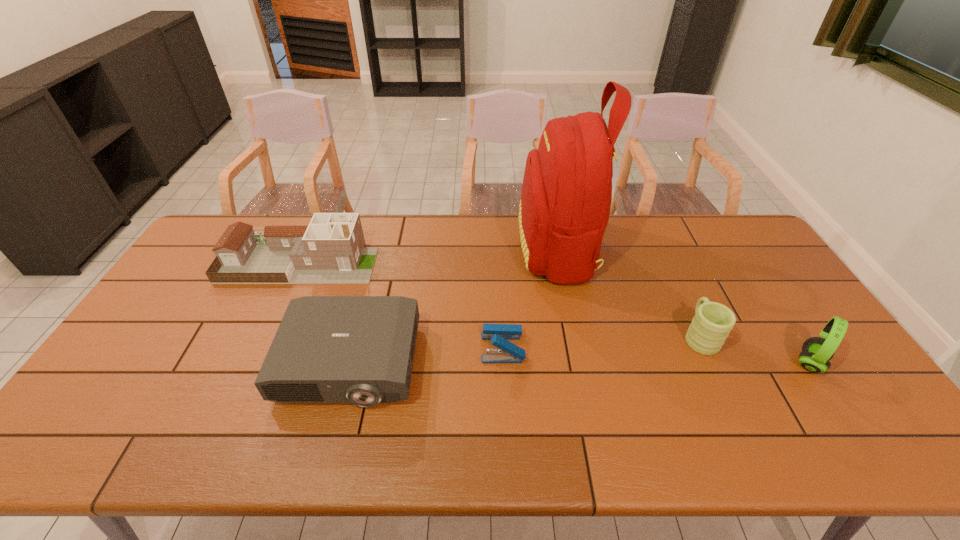
Image resolution: width=960 pixels, height=540 pixels. I want to click on free space that is in between the tallest object and the second object from right to left, so click(x=628, y=292).

Identify the location of vacant point located between the headset and the mug. This screenshot has width=960, height=540. (755, 349).

Where is `unoccupied area between the headset and the second object from right to left`? This screenshot has width=960, height=540. unoccupied area between the headset and the second object from right to left is located at coordinates (755, 349).

Where is `empty space between the projector and the rightmost object`? This screenshot has height=540, width=960. empty space between the projector and the rightmost object is located at coordinates (580, 363).

You are a GUI agent. You are given a task and a screenshot of the screen. Output one action in this format:
    pyautogui.click(x=<x>, y=<y>)
    Task: Click on the unoccupied area between the projector and the fourth object from right to left
    The width and height of the screenshot is (960, 540).
    Given the screenshot: What is the action you would take?
    pyautogui.click(x=426, y=355)

Identify the location of free space that is in between the rightmost object and the third object from right to left. (684, 306).

In order to click on free space between the fourth object from right to left and the projector in this screenshot , I will do `click(426, 355)`.

Where is `free space between the dollhouse and the second object from right to left`? The width and height of the screenshot is (960, 540). free space between the dollhouse and the second object from right to left is located at coordinates (499, 299).

Select which object appears as the fifth closest to the rightmost object. Please provide its 2D coordinates. Your answer should be formatted as a tuple, i.e. [(x, y)], where the tuple contains the x and y coordinates of a point satisfying the conditions above.

[(330, 250)]

Locate an element on the screen. object that is the closest to the stapler is located at coordinates (566, 196).